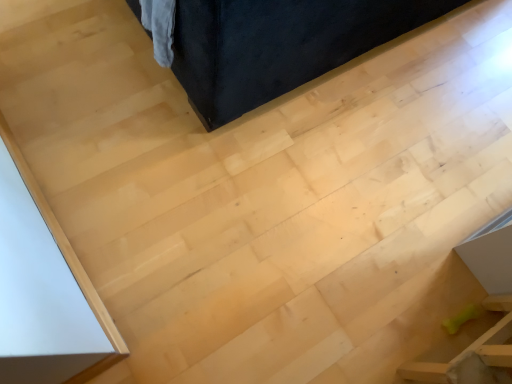
Question: From their relative heights in the image, would you say green rubber bone at lower right, acting as the second furniture starting from the top, is taller or shorter than velvet dark blue couch at upper center, placed as the 2th furniture when sorted from bottom to top?

Choices:
 (A) tall
 (B) short

Answer: (B)

Question: Visually, is green rubber bone at lower right, arranged as the first furniture when ordered from the bottom, positioned to the left or to the right of velvet dark blue couch at upper center, the first furniture from the top?

Choices:
 (A) right
 (B) left

Answer: (A)

Question: Is point (487, 355) closer or farther from the camera than point (337, 21)?

Choices:
 (A) closer
 (B) farther

Answer: (A)

Question: Considering the positions of velvet dark blue couch at upper center, placed as the 2th furniture when sorted from bottom to top, and green rubber bone at lower right, arranged as the first furniture when ordered from the bottom, in the image, is velvet dark blue couch at upper center, placed as the 2th furniture when sorted from bottom to top, wider or thinner than green rubber bone at lower right, arranged as the first furniture when ordered from the bottom,?

Choices:
 (A) thin
 (B) wide

Answer: (B)

Question: Considering the relative positions of velvet dark blue couch at upper center, the first furniture from the top, and green rubber bone at lower right, acting as the second furniture starting from the top, in the image provided, is velvet dark blue couch at upper center, the first furniture from the top, to the left or to the right of green rubber bone at lower right, acting as the second furniture starting from the top,?

Choices:
 (A) right
 (B) left

Answer: (B)

Question: From the image's perspective, is velvet dark blue couch at upper center, placed as the 2th furniture when sorted from bottom to top, above or below green rubber bone at lower right, arranged as the first furniture when ordered from the bottom?

Choices:
 (A) below
 (B) above

Answer: (B)

Question: In terms of height, does velvet dark blue couch at upper center, the first furniture from the top, look taller or shorter compared to green rubber bone at lower right, acting as the second furniture starting from the top?

Choices:
 (A) short
 (B) tall

Answer: (B)